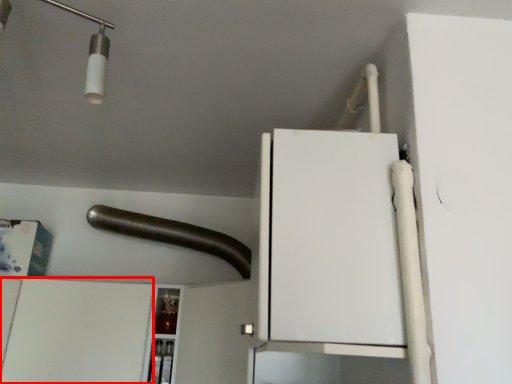
Question: From the image's perspective, where is cabinetry (annotated by the red box) located in relation to beam in the image?

Choices:
 (A) below
 (B) above

Answer: (A)